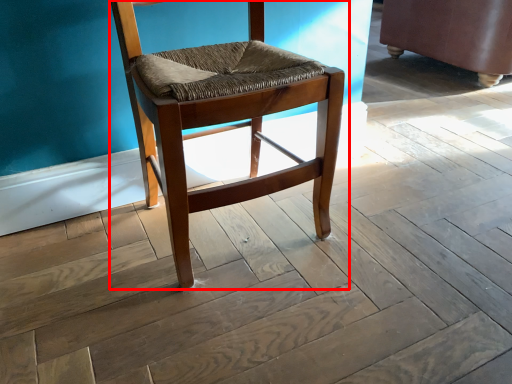
Question: From the image's perspective, where is chair (annotated by the red box) located in relation to swivel chair in the image?

Choices:
 (A) above
 (B) below

Answer: (B)